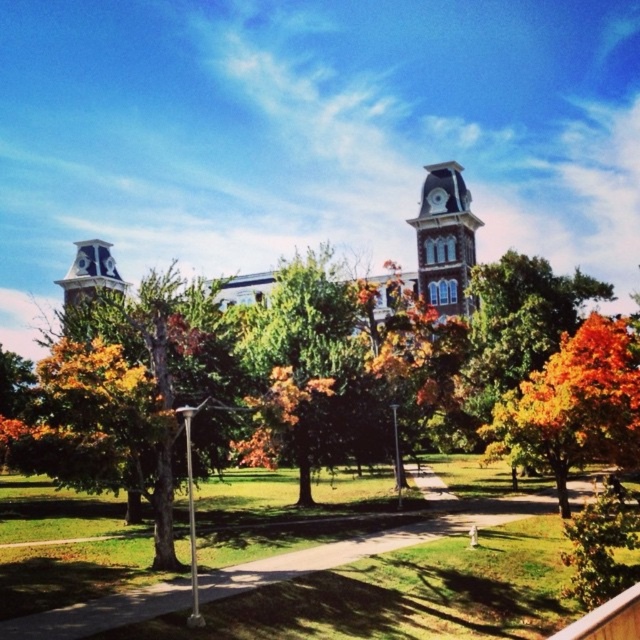
You are a student walking along the pathway in the campus scene. You want to take a photo of the orange leafy tree at center and the brown stone clock tower at upper center. Which object should you focus on first if you want to capture both in a single frame without moving the camera?

The orange leafy tree at center is located below the brown stone clock tower at upper center, so you should focus on the orange leafy tree at center first to ensure both are in the frame.

You are a student walking along the campus pathway and want to take a photo of both the orange leafy tree at center and the brown stone clock tower at upper center. Which object should you position closer to the left side of your camera frame to include both in the shot?

To include both the orange leafy tree at center and the brown stone clock tower at upper center in your photo, you should position the brown stone clock tower at upper center closer to the left side of your camera frame since the orange leafy tree at center is located to the right of it.

You are a gardener planning to mow the green grass at lower center and trim the green leafy tree at center. Based on their sizes, which task would require more time? Please explain your reasoning.

The green leafy tree at center occupies less space than green grass at lower center, so mowing the green grass at lower center would require more time since it covers a larger area.